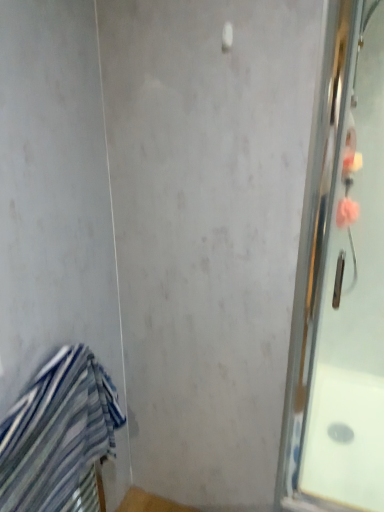
Question: Considering the positions of blue striped towel at lower left and clear glass shower door at right in the image, is blue striped towel at lower left wider or thinner than clear glass shower door at right?

Choices:
 (A) wide
 (B) thin

Answer: (A)

Question: From the image's perspective, is blue striped towel at lower left above or below clear glass shower door at right?

Choices:
 (A) above
 (B) below

Answer: (B)

Question: Is blue striped towel at lower left spatially inside clear glass shower door at right, or outside of it?

Choices:
 (A) inside
 (B) outside

Answer: (B)

Question: Is clear glass shower door at right wider or thinner than blue striped towel at lower left?

Choices:
 (A) wide
 (B) thin

Answer: (B)

Question: Is clear glass shower door at right to the left or to the right of blue striped towel at lower left in the image?

Choices:
 (A) right
 (B) left

Answer: (A)

Question: From the image's perspective, is clear glass shower door at right above or below blue striped towel at lower left?

Choices:
 (A) above
 (B) below

Answer: (A)

Question: Considering the positions of clear glass shower door at right and blue striped towel at lower left in the image, is clear glass shower door at right bigger or smaller than blue striped towel at lower left?

Choices:
 (A) big
 (B) small

Answer: (B)